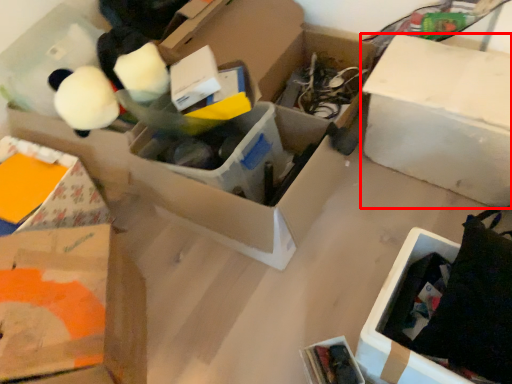
Question: In this image, where is box (annotated by the red box) located relative to cardboard box?

Choices:
 (A) right
 (B) left

Answer: (A)